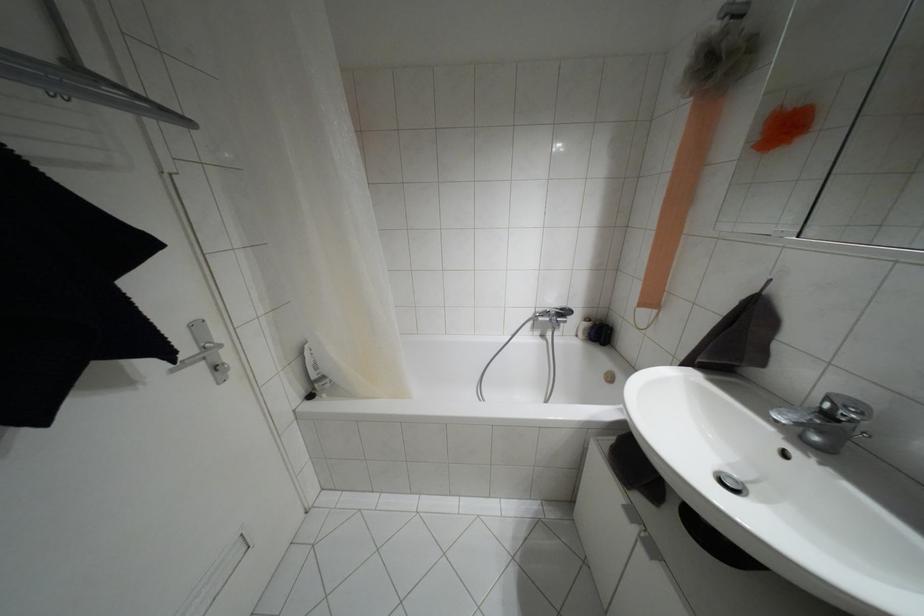
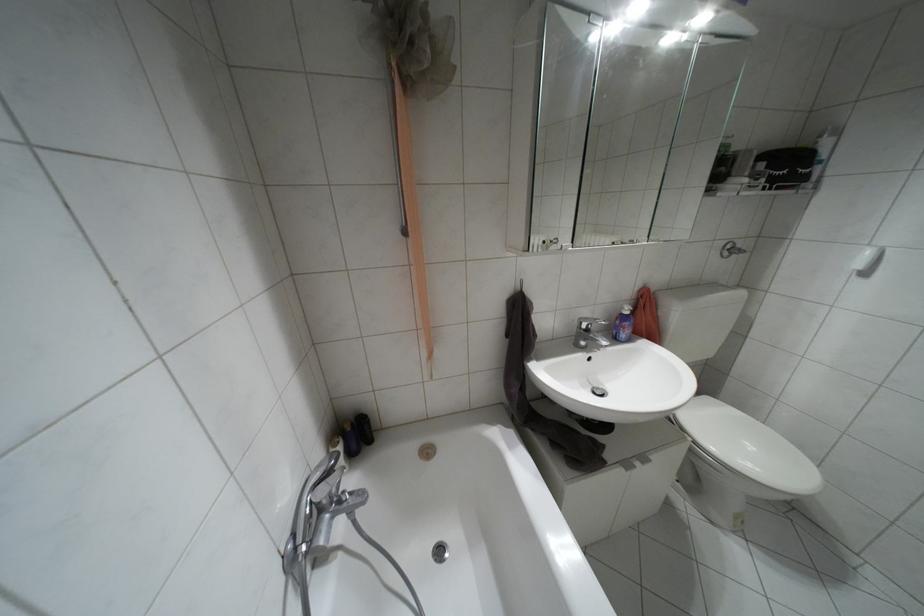
Find the pixel in the second image that matches pixel 825 414 in the first image.

(587, 330)